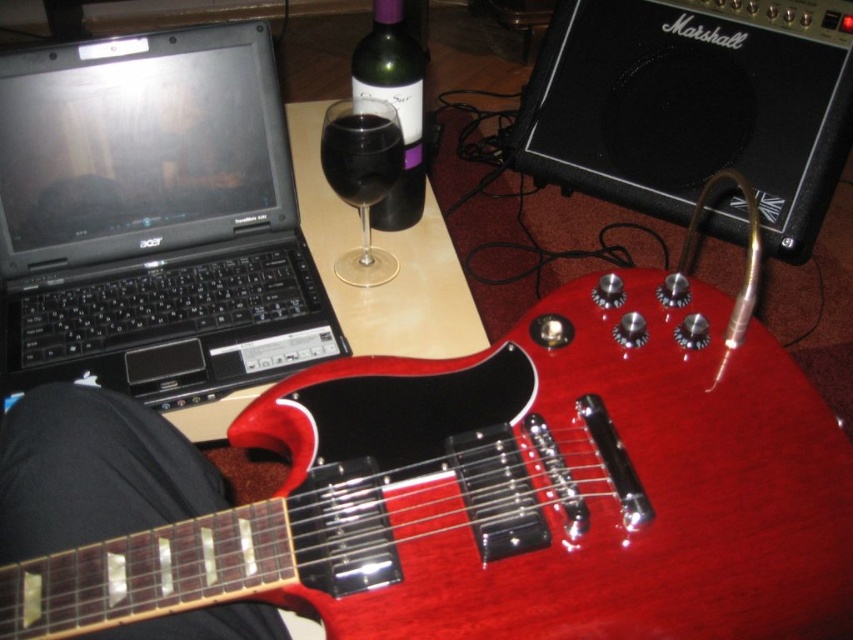
Question: Does glossy wood guitar at center appear under black matte laptop at upper left?

Choices:
 (A) no
 (B) yes

Answer: (B)

Question: Does glossy wood guitar at center appear under transparent glass at upper center?

Choices:
 (A) yes
 (B) no

Answer: (A)

Question: Which point is closer to the camera?

Choices:
 (A) (379, 172)
 (B) (399, 168)
 (C) (363, 52)
 (D) (270, 448)

Answer: (D)

Question: Which object is the closest to the transparent glass at upper center?

Choices:
 (A) green glass bottle at center
 (B) glossy wood guitar at center
 (C) transparent glass at center

Answer: (C)

Question: Which point is farther to the camera?

Choices:
 (A) (398, 152)
 (B) (387, 120)
 (C) (57, 337)
 (D) (577, 326)

Answer: (B)

Question: Does transparent glass at upper center have a lesser width compared to transparent glass at center?

Choices:
 (A) no
 (B) yes

Answer: (A)